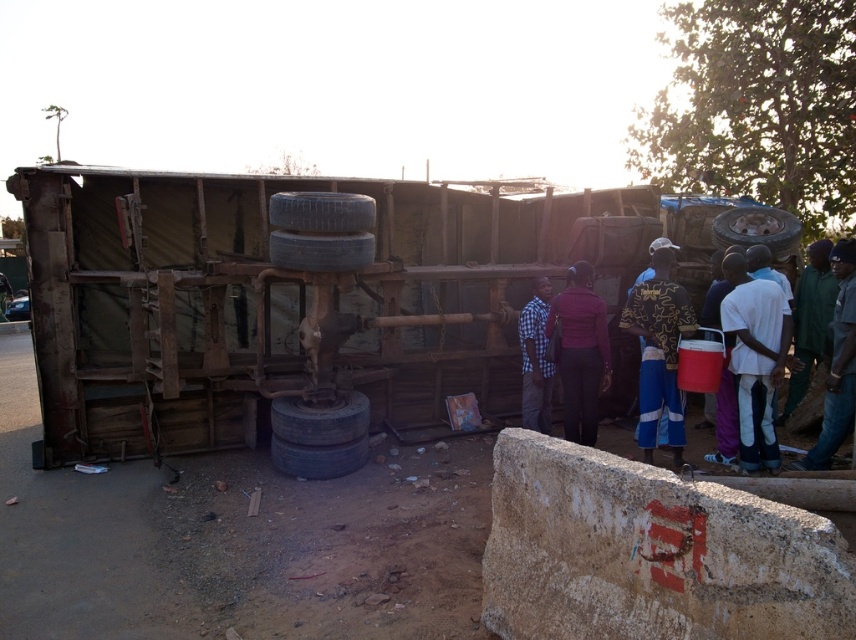
You are standing at the point with coordinates point (x=846, y=371) and want to walk to the point with coordinates point (x=317, y=253). Which direction should you walk to reach the destination?

You should walk backward because point (x=846, y=371) is in front of point (x=317, y=253), so moving backward will lead you towards the destination.

You are a photographer trying to capture a clear shot of the green fabric jacket at right and the rusty metal tire at center. Since you want both subjects to appear equally prominent in the photo, which object should you zoom in on more?

The green fabric jacket at right is larger in size than the rusty metal tire at center. To make both appear equally prominent, you should zoom in more on the rusty metal tire at center to enlarge its image in the photo.